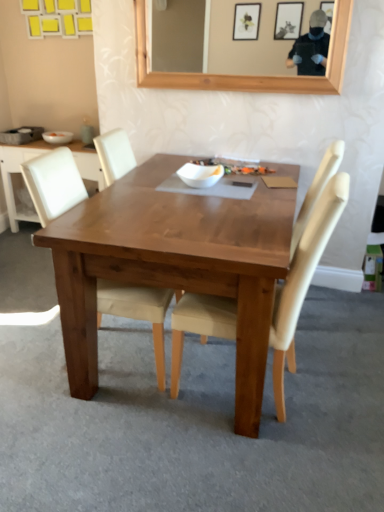
This screenshot has width=384, height=512. Find the location of `free spot to the right of white matte bowl at center, which appears as the first bowl when ordered from the bottom`. free spot to the right of white matte bowl at center, which appears as the first bowl when ordered from the bottom is located at coordinates (243, 190).